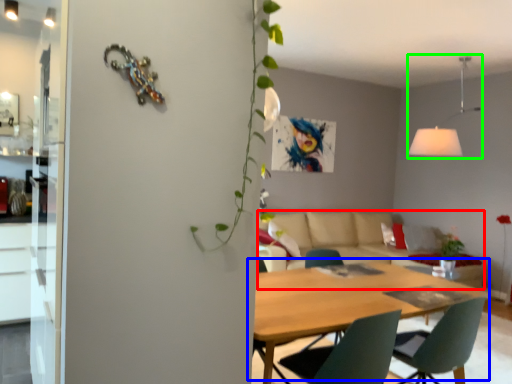
Question: Considering the real-world distances, which object is farthest from couch (highlighted by a red box)? kitchen & dining room table (highlighted by a blue box) or light fixture (highlighted by a green box)?

Choices:
 (A) kitchen & dining room table
 (B) light fixture

Answer: (A)